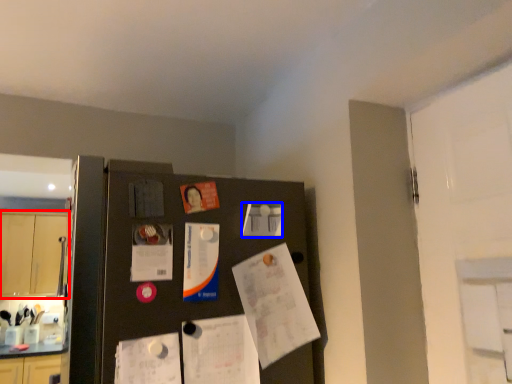
Question: Which of the following is the closest to the observer, cabinetry (highlighted by a red box) or poster (highlighted by a blue box)?

Choices:
 (A) cabinetry
 (B) poster

Answer: (B)